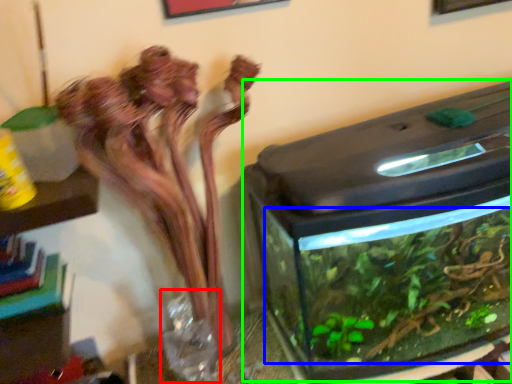
Question: Which object is the farthest from glass vase (highlighted by a red box)? Choose among these: plant (highlighted by a blue box) or water tank (highlighted by a green box).

Choices:
 (A) plant
 (B) water tank

Answer: (B)